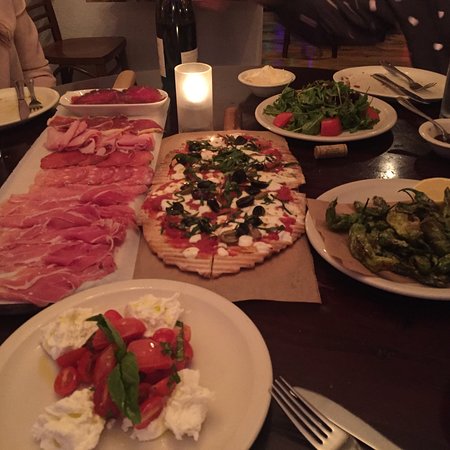
Find the location of a particular element. Image resolution: width=450 pixels, height=450 pixels. knives is located at coordinates (336, 410), (415, 94), (25, 110).